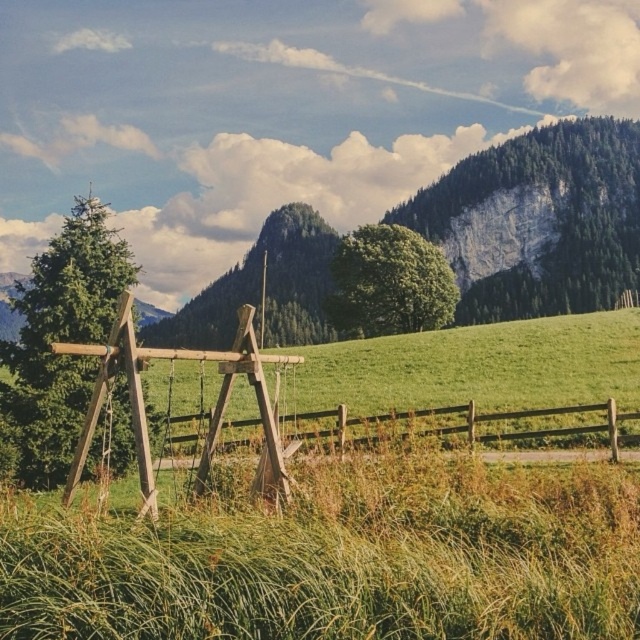
Question: Among these objects, which one is farthest from the camera?

Choices:
 (A) green grassy at center
 (B) brown wooden fence at center

Answer: (B)

Question: Is the position of green grassy at center more distant than that of brown wooden fence at center?

Choices:
 (A) yes
 (B) no

Answer: (B)

Question: Is the position of green grassy at center more distant than that of brown wooden fence at center?

Choices:
 (A) no
 (B) yes

Answer: (A)

Question: Is green grassy at center smaller than brown wooden fence at center?

Choices:
 (A) no
 (B) yes

Answer: (B)